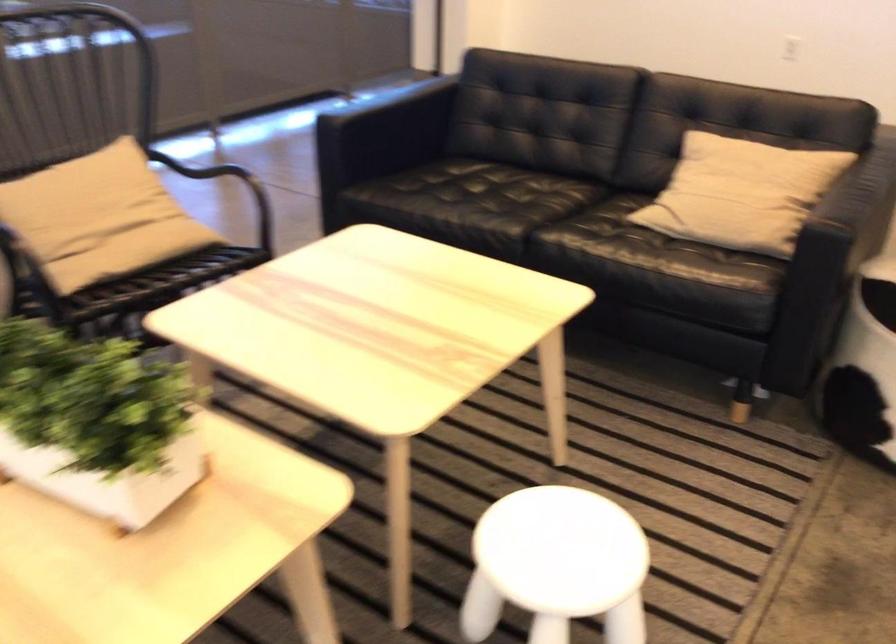
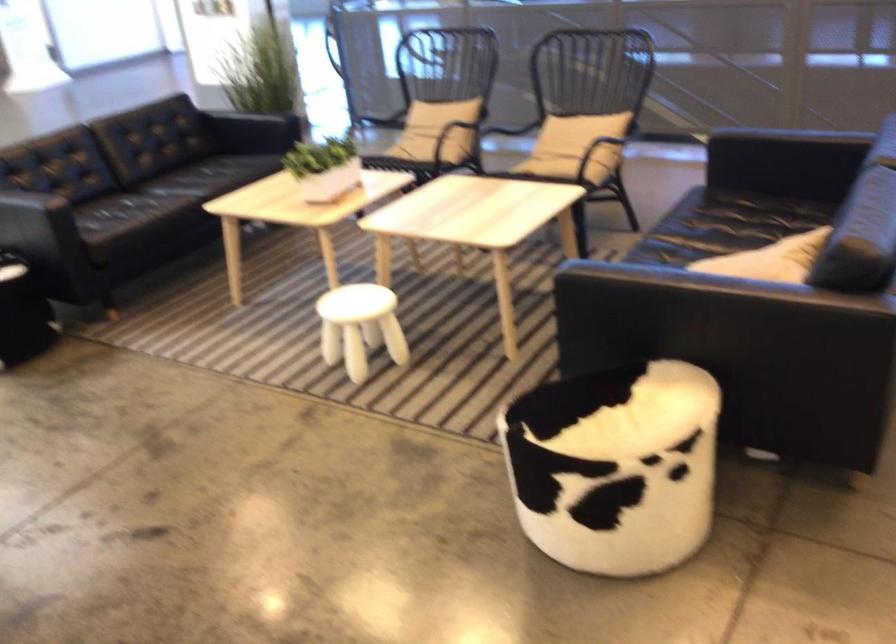
Locate, in the second image, the point that corresponds to the point at 176,218 in the first image.

(574, 147)